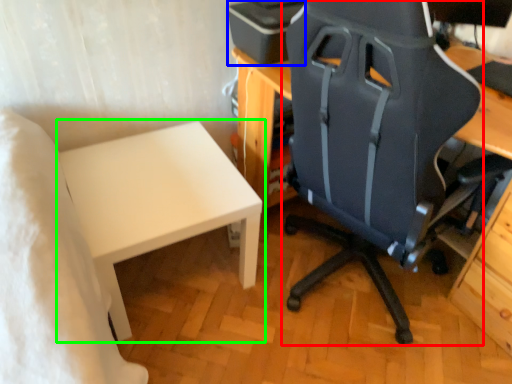
Question: Based on their relative distances, which object is nearer to chair (highlighted by a red box)? Choose from printer (highlighted by a blue box) and table (highlighted by a green box).

Choices:
 (A) printer
 (B) table

Answer: (A)